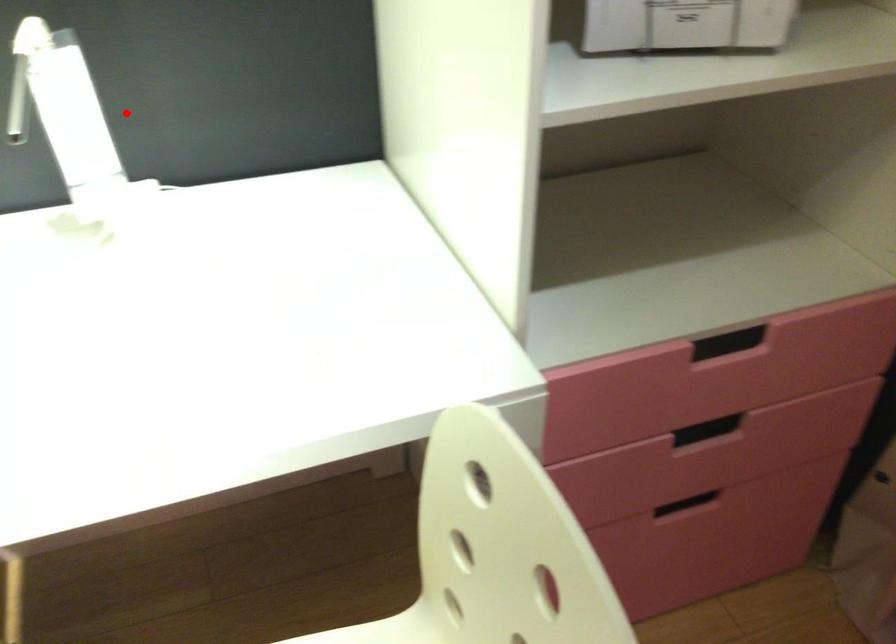
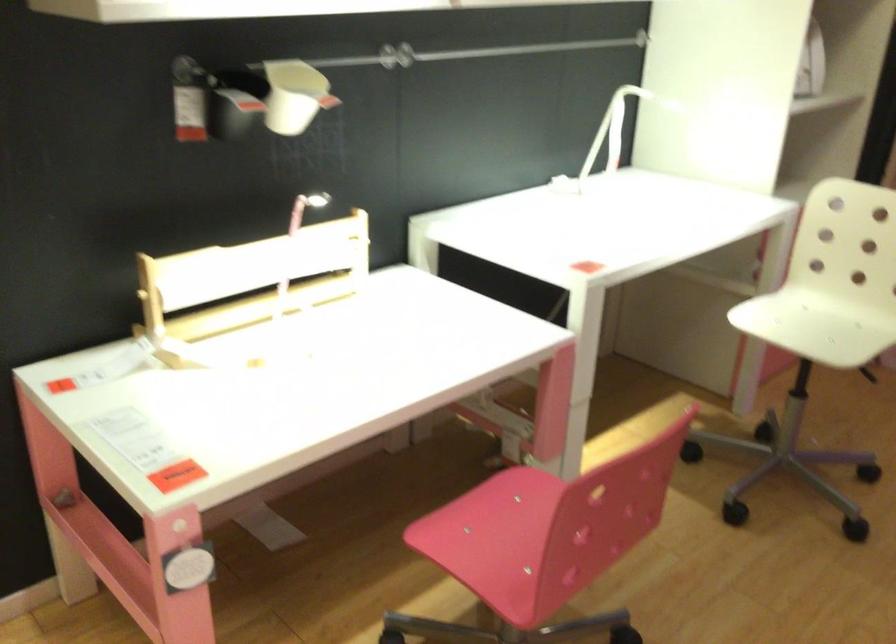
Locate, in the second image, the point that corresponds to the highlighted location in the first image.

(618, 126)